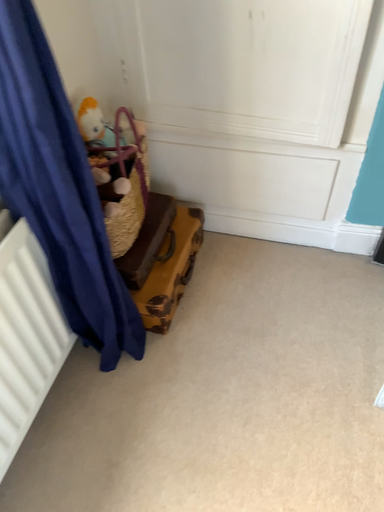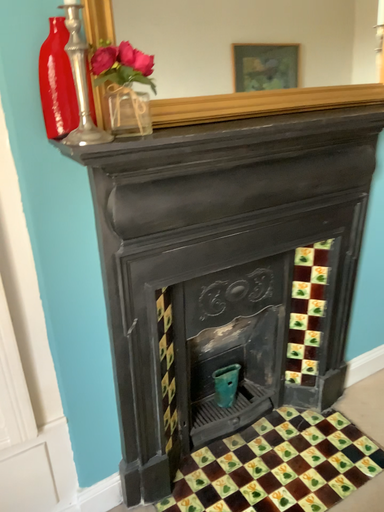
Question: How did the camera likely rotate when shooting the video?

Choices:
 (A) rotated left
 (B) rotated right

Answer: (B)